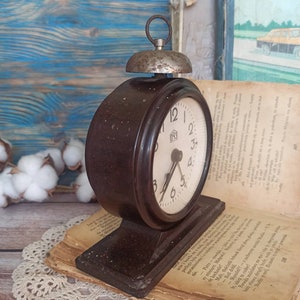
Find the location of `clock face`. clock face is located at coordinates (169, 176).